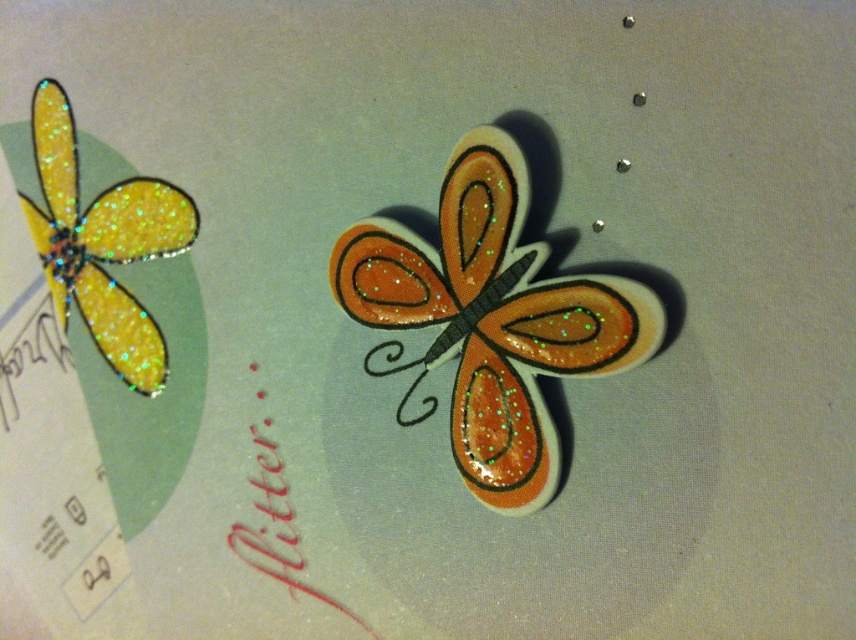
Question: Which object is farther from the camera taking this photo?

Choices:
 (A) glittery yellow butterfly at upper left
 (B) glittery orange fabric butterfly at center

Answer: (A)

Question: Is glittery orange fabric butterfly at center closer to the viewer compared to glittery yellow butterfly at upper left?

Choices:
 (A) yes
 (B) no

Answer: (A)

Question: Does glittery orange fabric butterfly at center have a larger size compared to glittery yellow butterfly at upper left?

Choices:
 (A) yes
 (B) no

Answer: (A)

Question: Which object appears farthest from the camera in this image?

Choices:
 (A) glittery orange fabric butterfly at center
 (B) glittery yellow butterfly at upper left

Answer: (B)

Question: Does glittery orange fabric butterfly at center have a greater width compared to glittery yellow butterfly at upper left?

Choices:
 (A) yes
 (B) no

Answer: (A)

Question: Which object appears farthest from the camera in this image?

Choices:
 (A) glittery yellow butterfly at upper left
 (B) glittery orange fabric butterfly at center

Answer: (A)